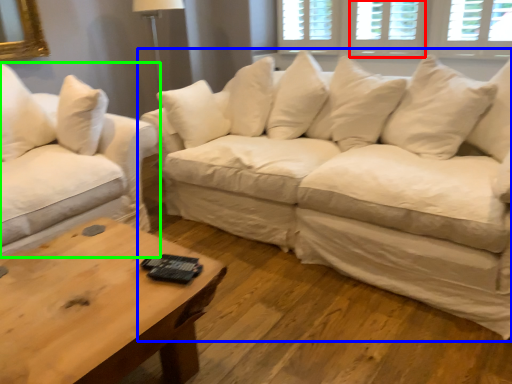
Question: Considering the real-world distances, which object is farthest from window (highlighted by a red box)? studio couch (highlighted by a blue box) or studio couch (highlighted by a green box)?

Choices:
 (A) studio couch
 (B) studio couch

Answer: (B)